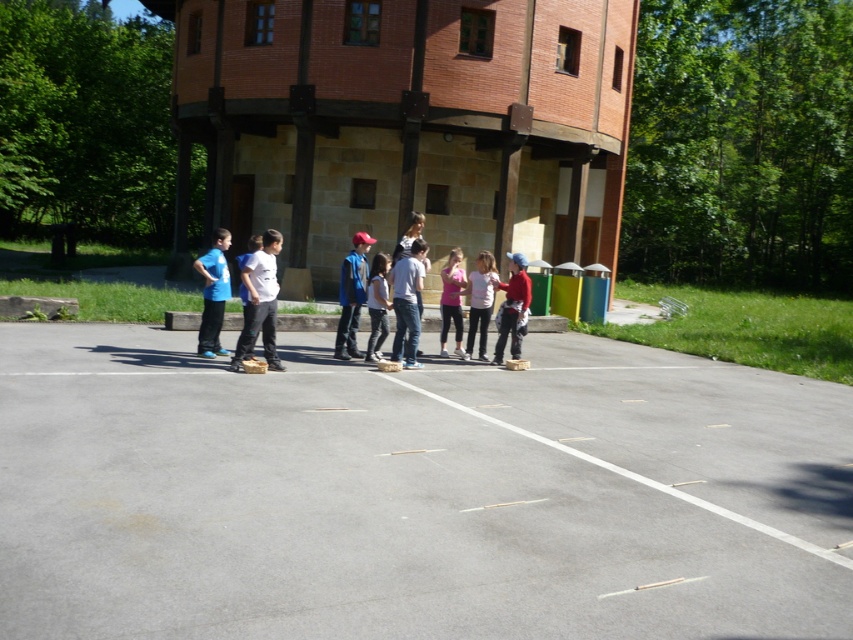
Question: Considering the real-world distances, which object is closest to the matte blue shirt at left?

Choices:
 (A) smooth white line at center
 (B) white matte shirt at center

Answer: (B)

Question: Does matte red helmet at center have a smaller size compared to white matte shirt at center?

Choices:
 (A) no
 (B) yes

Answer: (B)

Question: Observing the image, what is the correct spatial positioning of matte red helmet at center in reference to smooth white line at center?

Choices:
 (A) right
 (B) left

Answer: (A)

Question: Which of the following is the closest to the observer?

Choices:
 (A) smooth white line at center
 (B) white matte shirt at center
 (C) matte red helmet at center
 (D) asphalt at center

Answer: (D)

Question: Which object is the farthest from the smooth white line at center?

Choices:
 (A) matte red helmet at center
 (B) white matte shirt at center

Answer: (B)

Question: Where is asphalt at center located in relation to white matte shirt at center in the image?

Choices:
 (A) below
 (B) above

Answer: (A)